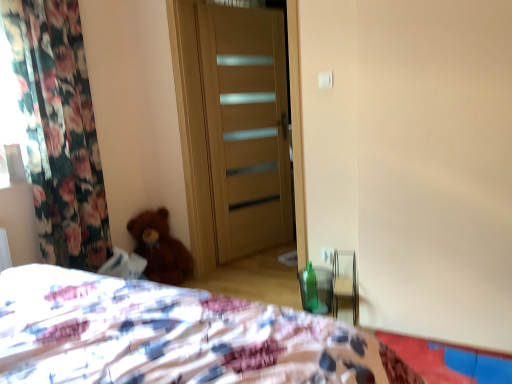
The height and width of the screenshot is (384, 512). Identify the location of free location above light brown wood door at center (from a real-world perspective). (239, 6).